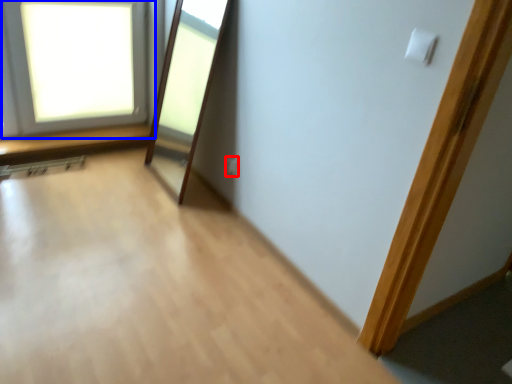
Question: Among these objects, which one is farthest to the camera, electric outlet (highlighted by a red box) or window (highlighted by a blue box)?

Choices:
 (A) electric outlet
 (B) window

Answer: (A)